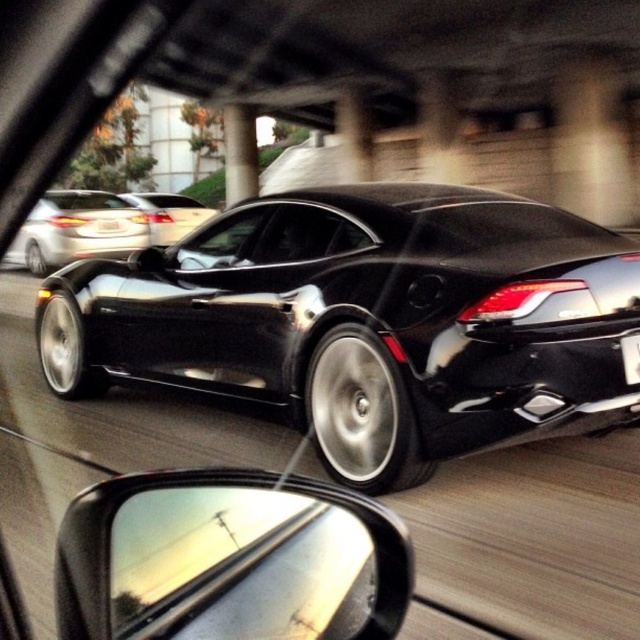
Question: Is black plastic license plate at rear in front of white plastic license plate at center?

Choices:
 (A) no
 (B) yes

Answer: (B)

Question: Estimate the real-world distances between objects in this image. Which object is farther from the glossy black car at upper center?

Choices:
 (A) concrete/rough pillar at center
 (B) black plastic side mirror at lower left
 (C) satin silver car at upper left

Answer: (B)

Question: Which object is positioned farthest from the concrete/rough pillar at center?

Choices:
 (A) shiny black sports car at center
 (B) white plastic license plate at center

Answer: (A)

Question: Which point is farther to the camera?

Choices:
 (A) (205, 256)
 (B) (225, 193)
 (C) (154, 214)

Answer: (B)

Question: Where is black plastic side mirror at lower left located in relation to concrete/rough pillar at center in the image?

Choices:
 (A) left
 (B) right

Answer: (B)

Question: Considering the relative positions of black plastic side mirror at lower left and white plastic license plate at center in the image provided, where is black plastic side mirror at lower left located with respect to white plastic license plate at center?

Choices:
 (A) left
 (B) right

Answer: (B)